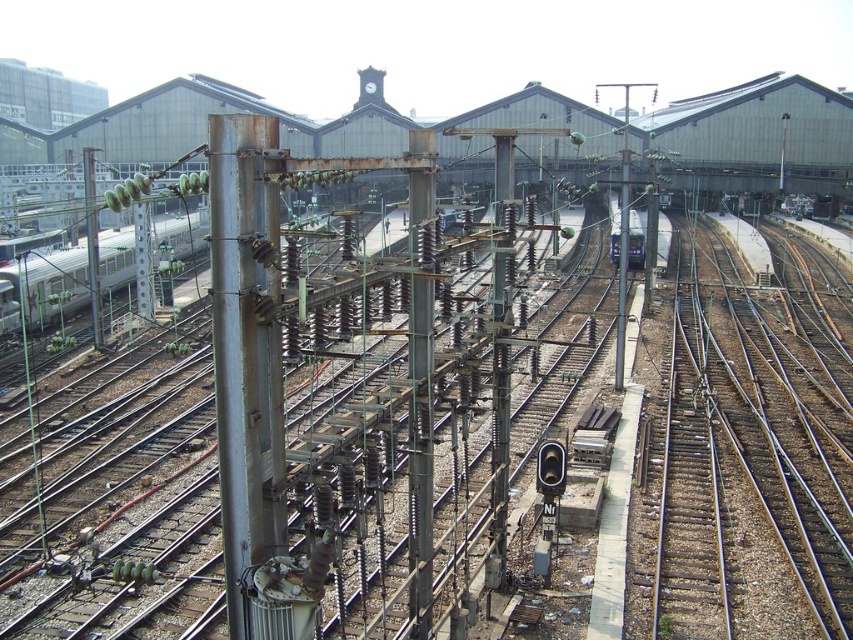
In the scene shown: Does rusty metal pole at center appear on the left side of metallic pole at left?

In fact, rusty metal pole at center is to the right of metallic pole at left.

Can you confirm if rusty metal pole at center is positioned below metallic pole at left?

Correct, rusty metal pole at center is located below metallic pole at left.

Does point (415, 365) come farther from viewer compared to point (97, 285)?

No, it is not.

I want to click on rusty metal pole at center, so click(421, 401).

Find the location of `brown gravel train track at right`. brown gravel train track at right is located at coordinates (749, 445).

Is brown gravel train track at right bigger than metallic pole at left?

Indeed, brown gravel train track at right has a larger size compared to metallic pole at left.

Is point (815, 547) behind point (91, 154)?

No, it is in front of (91, 154).

At what (x,y) coordinates should I click in order to perform the action: click on brown gravel train track at right. Please return your answer as a coordinate pair (x, y). Looking at the image, I should click on (749, 445).

Is rusty metal pole at center-left to the left of metallic blue train at center from the viewer's perspective?

Indeed, rusty metal pole at center-left is positioned on the left side of metallic blue train at center.

Is rusty metal pole at center-left shorter than metallic blue train at center?

Yes.

Who is more distant from viewer, (264, 426) or (610, 211)?

Positioned behind is point (610, 211).

At what (x,y) coordinates should I click in order to perform the action: click on rusty metal pole at center-left. Please return your answer as a coordinate pair (x, y). Looking at the image, I should click on (247, 352).